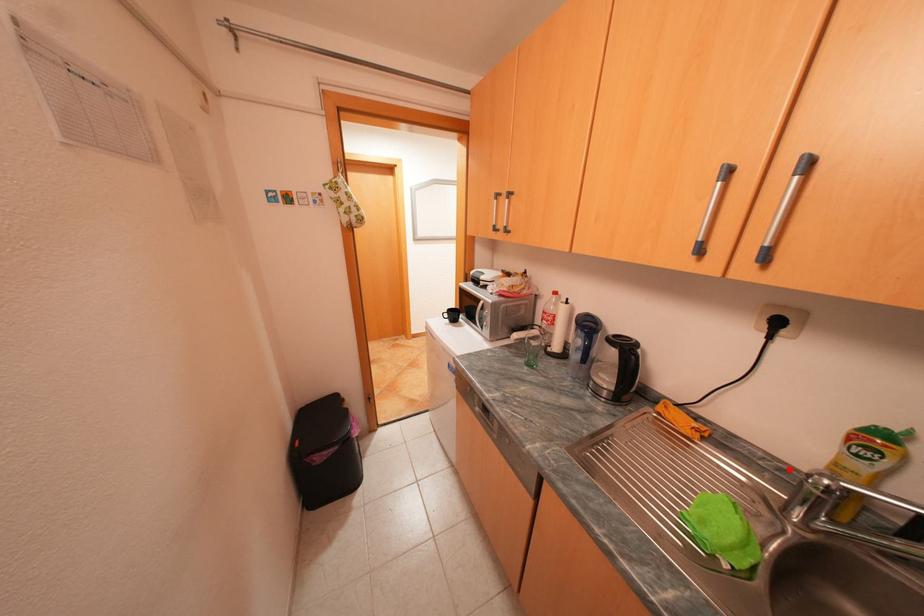
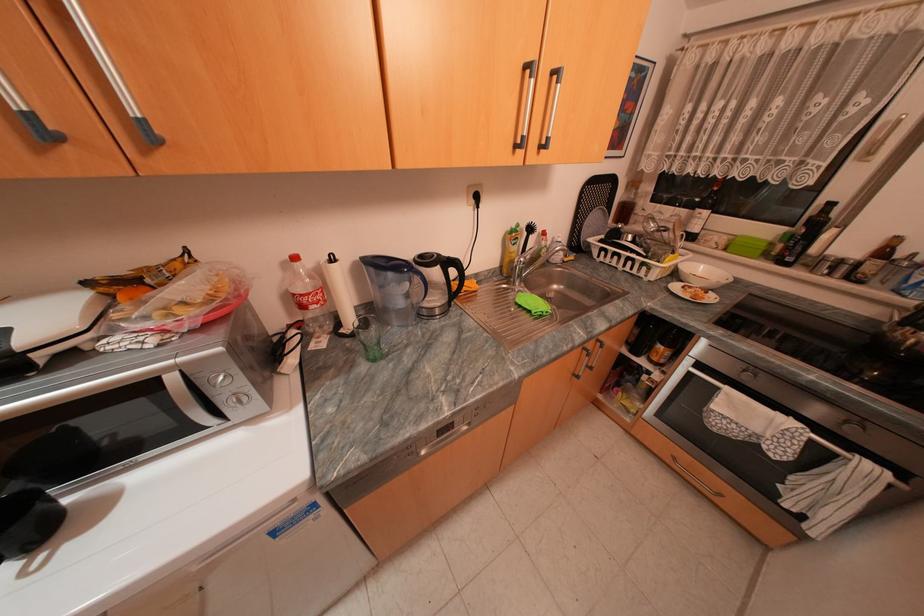
Question: A red point is marked in image1. In image2, is the corresponding 3D point closer to the camera or farther? Reply with the corresponding letter.

Choices:
 (A) The corresponding 3D point is closer.
 (B) The corresponding 3D point is farther.

Answer: (A)